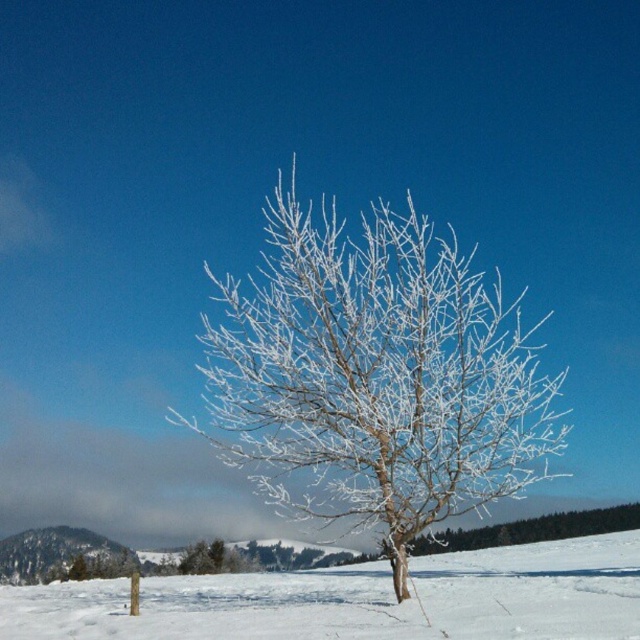
Who is more distant from viewer, (381, 308) or (342, 609)?

Positioned behind is point (381, 308).

Based on the photo, can you confirm if frosted white tree at center is positioned to the right of white frosty snow at center?

Incorrect, frosted white tree at center is not on the right side of white frosty snow at center.

Is point (438, 492) behind point (481, 592)?

No.

You are a GUI agent. You are given a task and a screenshot of the screen. Output one action in this format:
    pyautogui.click(x=<x>, y=<y>)
    Task: Click on the frosted white tree at center
    The height and width of the screenshot is (640, 640).
    Given the screenshot: What is the action you would take?
    pyautogui.click(x=374, y=376)